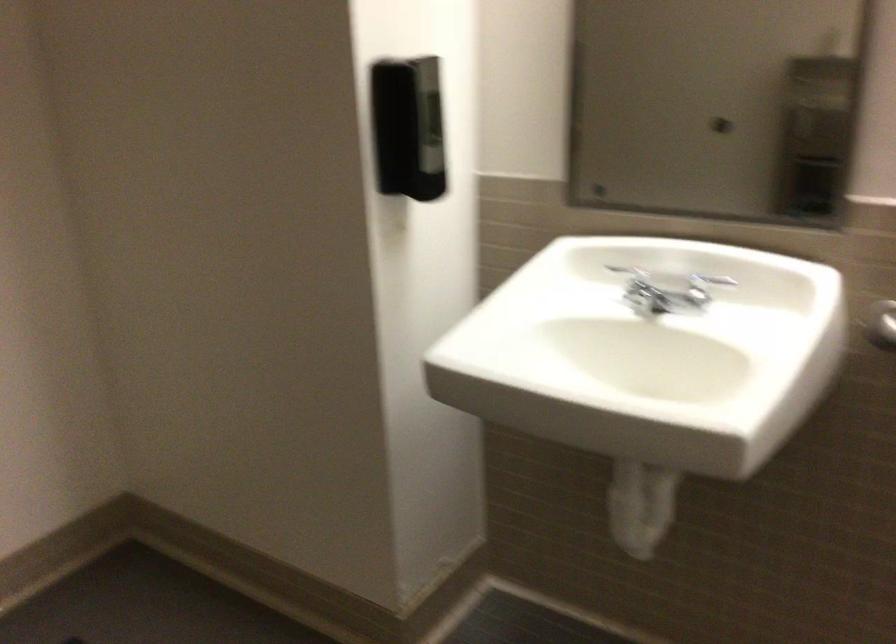
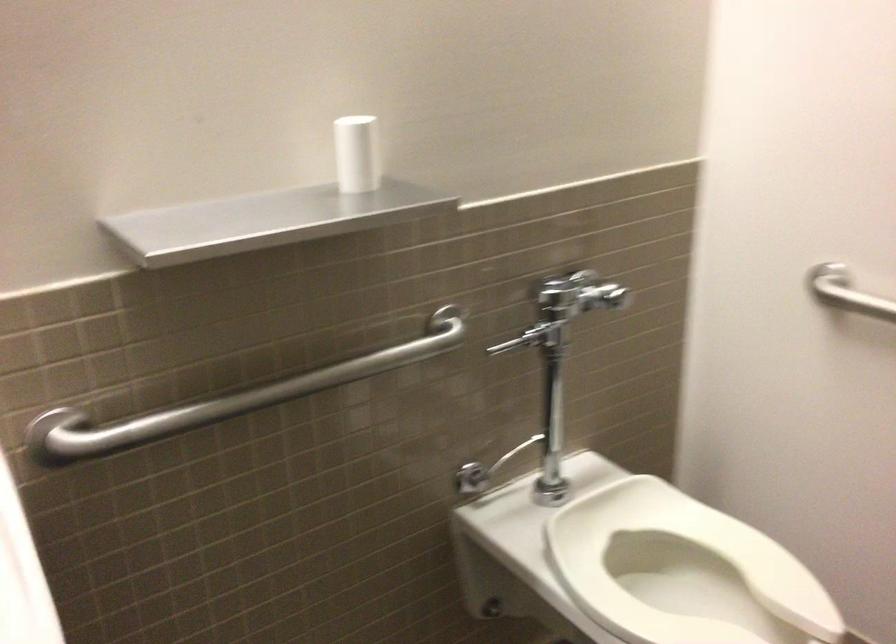
Question: The images are taken continuously from a first-person perspective. In which direction is your viewpoint rotating?

Choices:
 (A) Left
 (B) Right
 (C) Up
 (D) Down

Answer: (B)